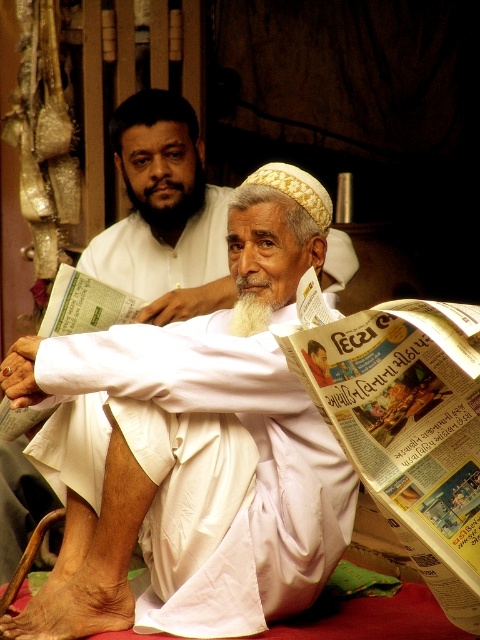
Question: Does white clothed man at center have a lesser width compared to white soft beard at center?

Choices:
 (A) yes
 (B) no

Answer: (B)

Question: Based on their relative distances, which object is farther from the black beard at upper center?

Choices:
 (A) white clothed man at center
 (B) white soft beard at center

Answer: (A)

Question: Which point is closer to the camera?

Choices:
 (A) white clothed man at center
 (B) black beard at upper center
 (C) white soft beard at center

Answer: (A)

Question: Where is white clothed man at center located in relation to black beard at upper center in the image?

Choices:
 (A) right
 (B) left

Answer: (B)

Question: Based on their relative distances, which object is farther from the white soft beard at center?

Choices:
 (A) black beard at upper center
 (B) white clothed man at center

Answer: (A)

Question: Is white clothed man at center wider than black beard at upper center?

Choices:
 (A) yes
 (B) no

Answer: (B)